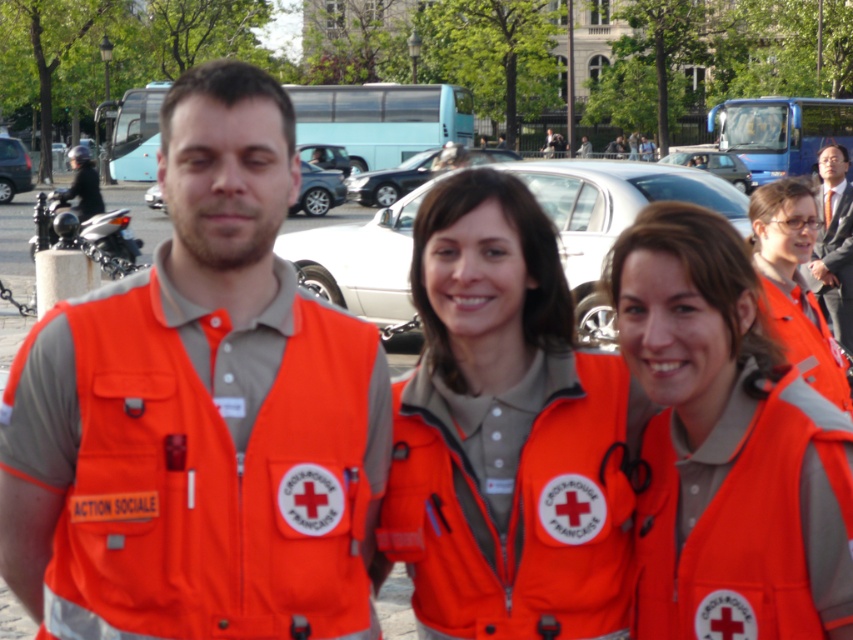
You are a photographer trying to capture the orange fabric vest at left in your shot. Given that your camera has a focal length of 50mm and you are positioned at point A, which is 2 meters away from the vest, can you estimate the approximate height of the vest in millimeters using the camera sensor size of 24mm?

The orange fabric vest at left is positioned at point (x=200, y=413). Using the camera sensor size of 24mm and a focal length of 50mm, the height can be calculated using the formula height_in_mm_sensor_plane equals sensor_height multiplied by distance divided by focal_length. Plugging in the numbers, the vest height would be approximately 24mm multiplied by 2 meters divided by 50mm, resulting in roughly 0.96mm. However, this is the sensor plane measurement, so actual real world height would require additional

You are a photographer trying to capture a group photo of the matte orange vest at center and the smooth suit at upper right. Since you want both subjects to appear equally sized in the photo, which subject should you move closer to and which should you move farther away from the camera?

The matte orange vest at center has a lesser width compared to the smooth suit at upper right. To make them appear the same size in the photo, move the matte orange vest at center closer to the camera and the smooth suit at upper right farther away.

You are a drone operator trying to capture a photo of the matte orange vest at center for a news article. The drone has a camera with a 100mm focal length lens. If the vest is located at coordinates 0.695 on the x and 0.851 on the y axis, what is the exact coordinate pair you should input into the drone to ensure it captures the vest in the center of the photo?

The exact coordinate pair to input into the drone should be 0.695 on the x and 0.851 on the y axis, as the matte orange vest at center is located at point (724, 444).